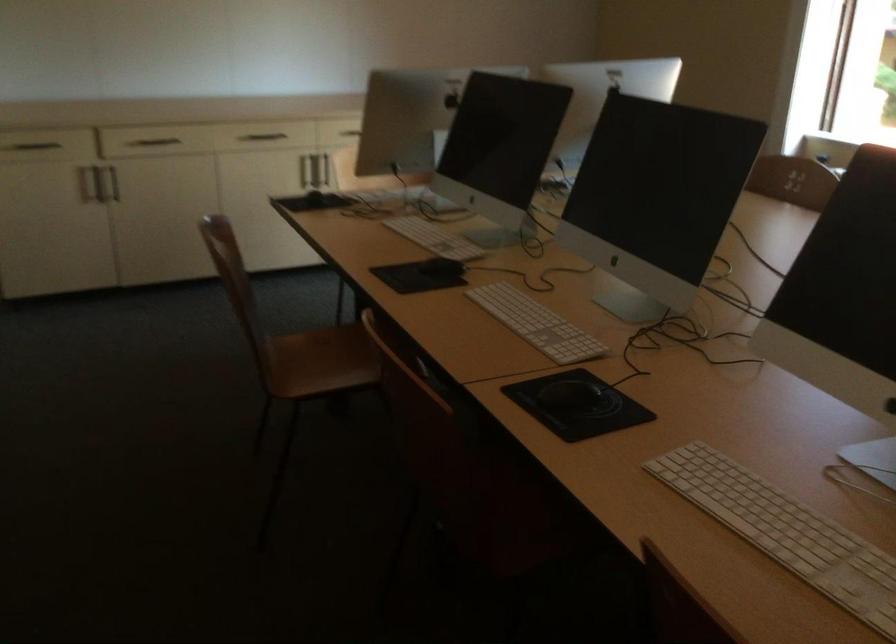
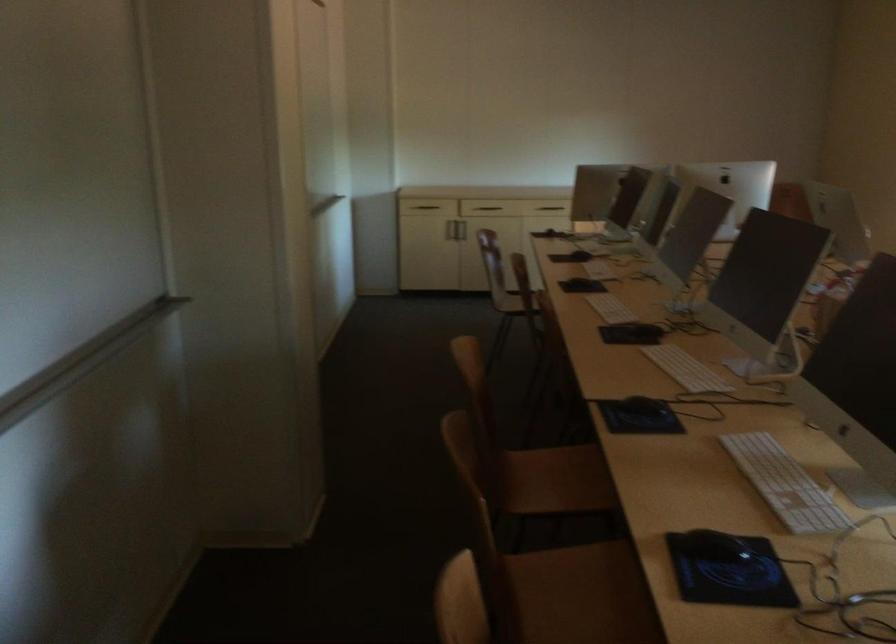
Where in the second image is the point corresponding to pixel 451 257 from the first image?

(593, 245)